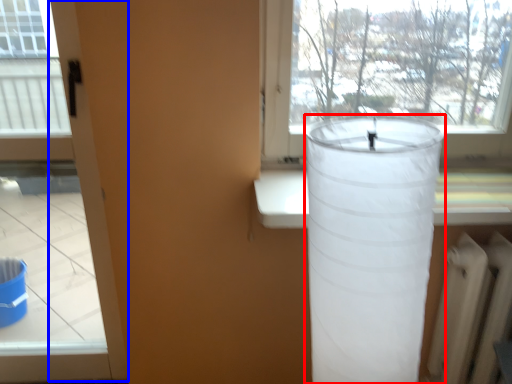
Question: Which point is further to the camera, lamp (highlighted by a red box) or screen door (highlighted by a blue box)?

Choices:
 (A) lamp
 (B) screen door

Answer: (B)